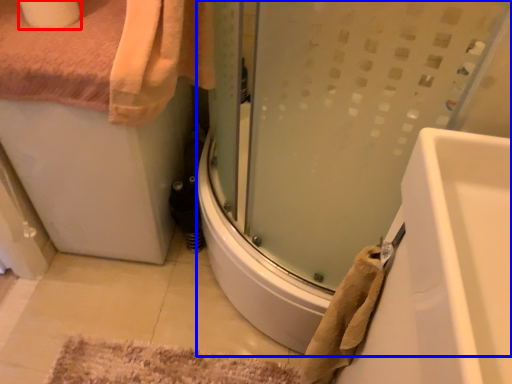
Question: Which object appears closest to the camera in this image, toilet paper (highlighted by a red box) or shower door (highlighted by a blue box)?

Choices:
 (A) toilet paper
 (B) shower door

Answer: (B)